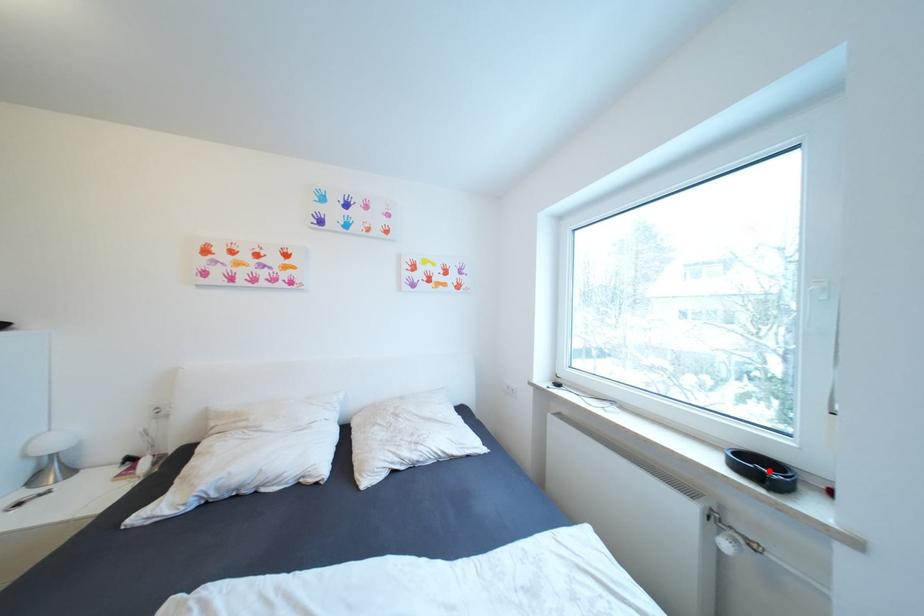
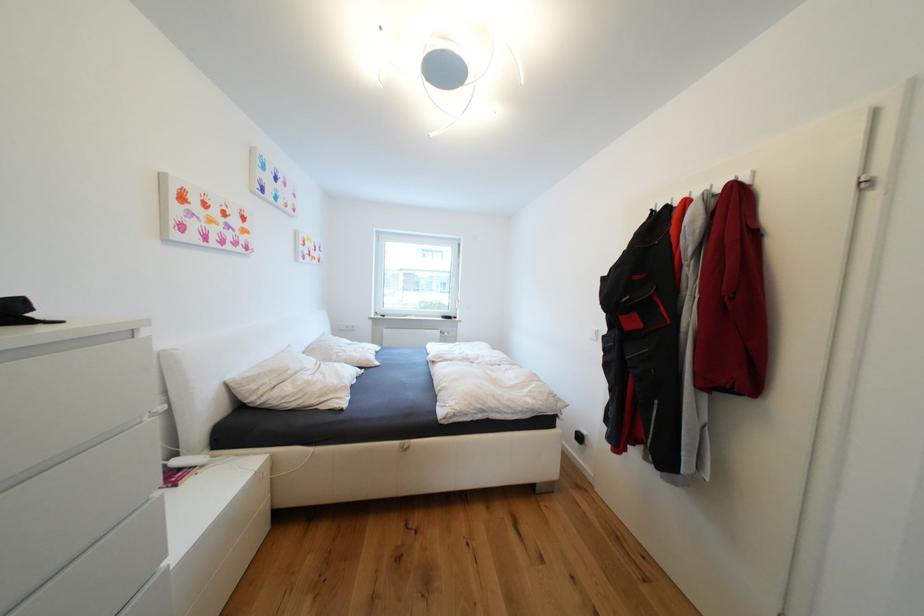
Question: I am providing you with two images of the same scene from different viewpoints. A red point is marked on the first image. Can you still see the location of the red point in image 2?

Choices:
 (A) Yes
 (B) No

Answer: (B)